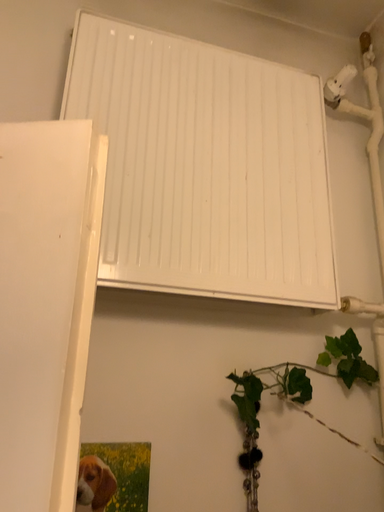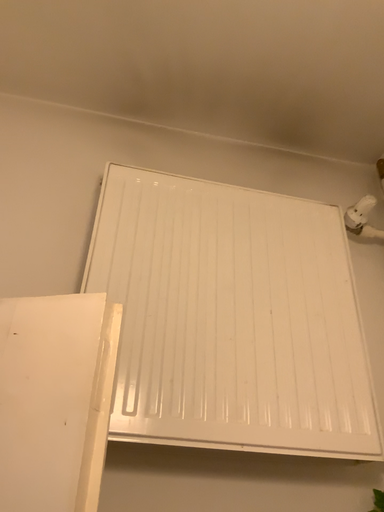
Question: How did the camera likely rotate when shooting the video?

Choices:
 (A) rotated upward
 (B) rotated downward

Answer: (A)